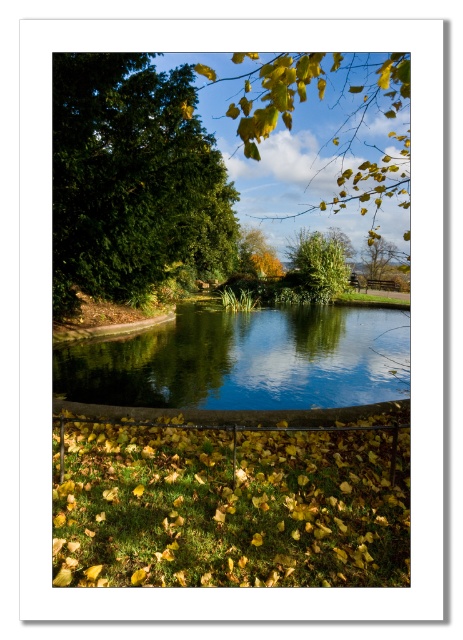
You are standing at the edge of the pond and want to see the reflection of the green leafy tree at upper left and the green leafy tree at upper center. Which tree do you think will have its reflection closer to you in the water?

The green leafy tree at upper left is positioned under green leafy tree at upper center, so its reflection will be closer to you in the water.

You are standing in the autumn scene and want to pick up the yellow matte leaves at lower center and the green leafy tree at upper left. Which object is easier to reach without moving your position?

The yellow matte leaves at lower center is closer to the viewer than the green leafy tree at upper left, so it is easier to reach without moving your position.